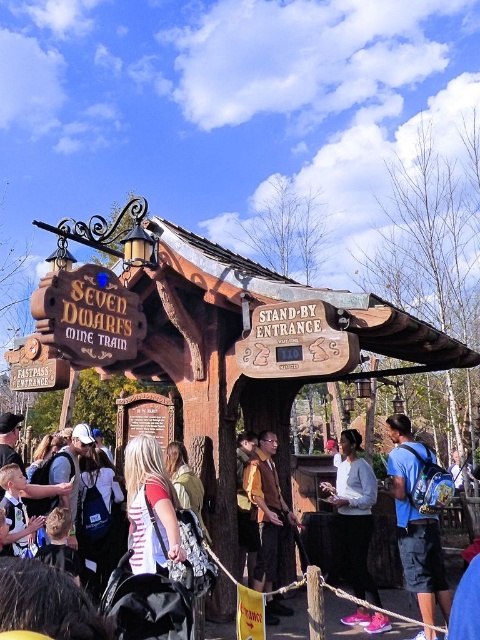
In the scene shown: You are standing at the entrance of the Seven Dwarfs Mine Train and want to reach the point marked at coordinates point (422, 579). If you can walk 3 feet per second, how many seconds will it take you to reach that point?

The distance between you and the point (422, 579) is 18.21 feet. At a walking speed of 3 feet per second, it will take approximately 6.07 seconds to reach the point.

You are standing at the entrance of the Seven Dwarfs Mine Train and want to locate the wooden sign at center. Based on the coordinates provided, where should you look?

The wooden sign at center is located at coordinates point (297, 342).